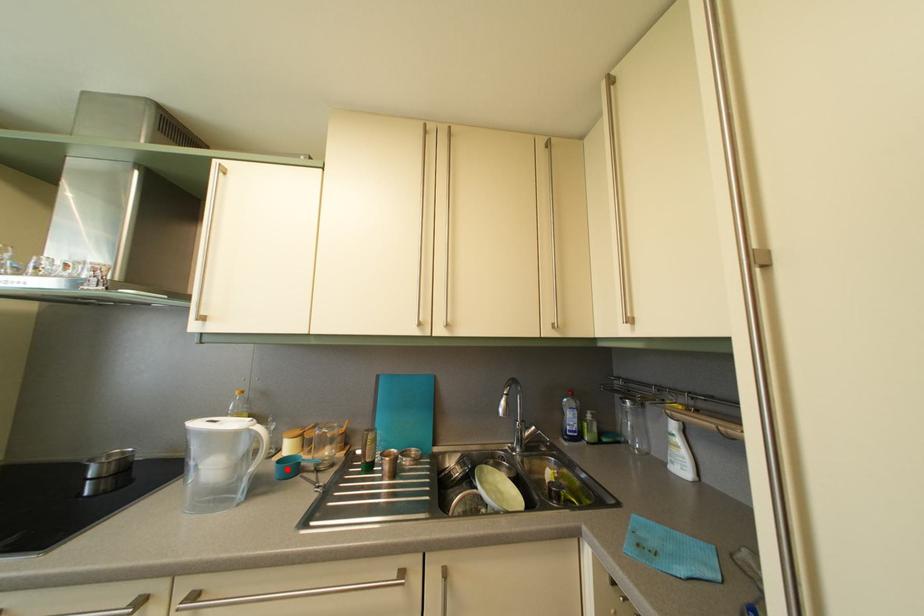
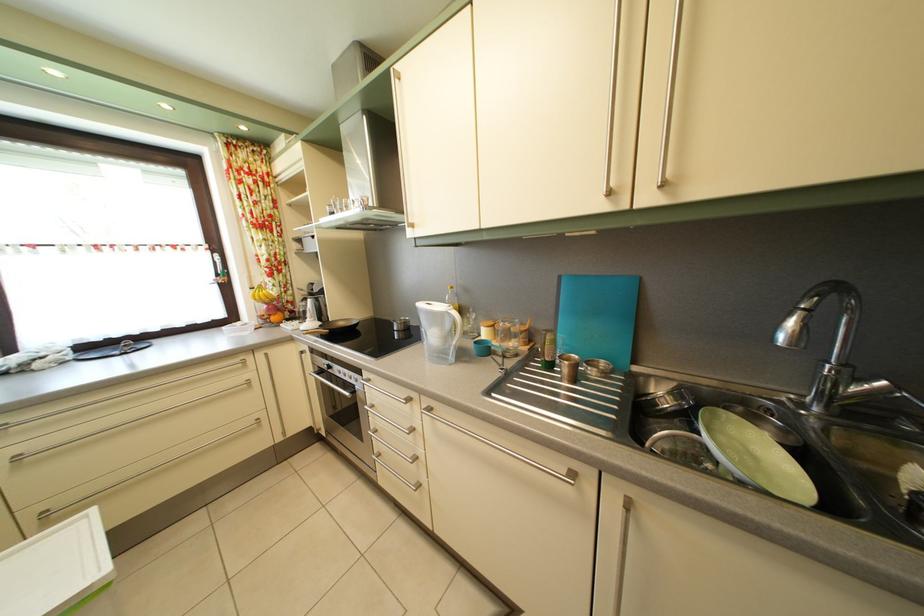
Locate, in the second image, the point that corresponds to the highlighted location in the first image.

(483, 350)